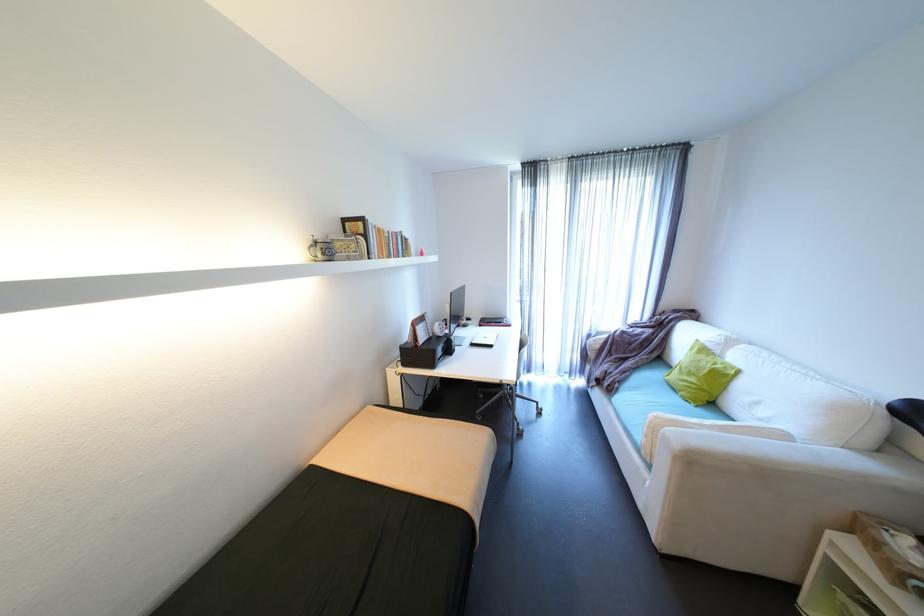
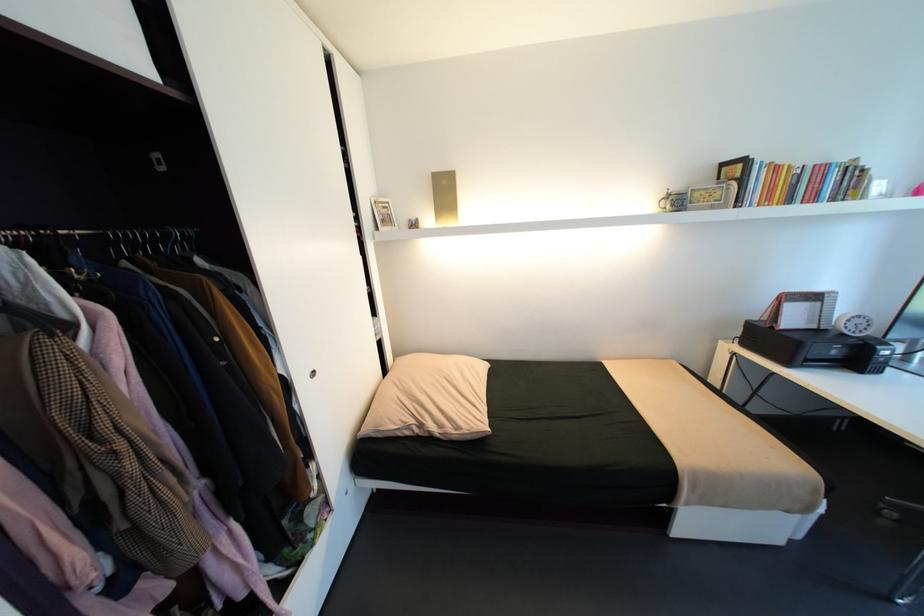
Locate, in the second image, the point that corresponds to the point at 446,337 in the first image.

(850, 334)